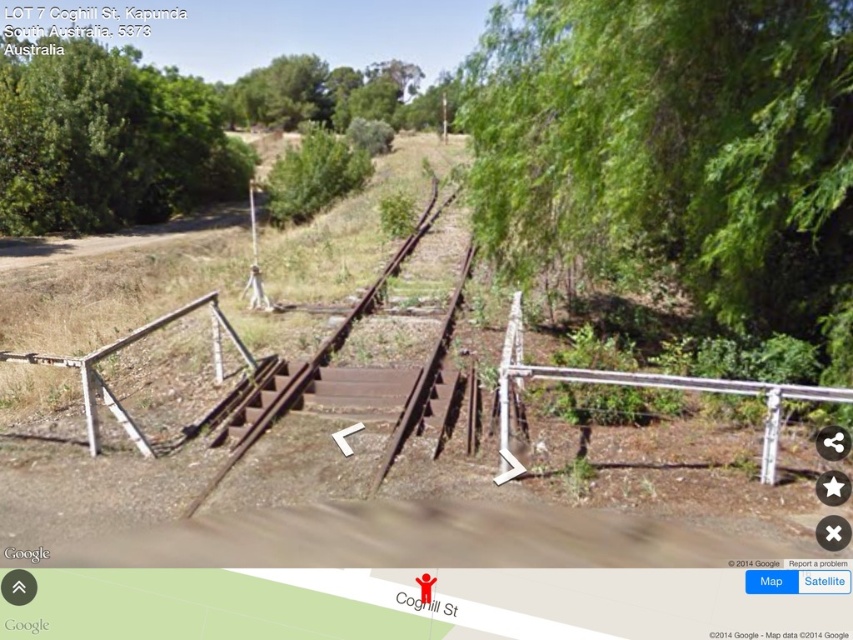
You are standing at the point marked by the coordinates point (106, 140) in the image of Kapunda, South Australia. What object is located at this point?

The point (106, 140) marks a green leafy tree at upper left.

You are a hiker planning to take a photo of the green leafy tree at center and the rusty metal rail at lower left. Based on their positions, which object should you frame first in your camera viewfinder to capture both in the same shot?

The green leafy tree at center is positioned on the left side of the rusty metal rail at lower left, so you should frame the green leafy tree at center first to ensure both objects are included in the shot.

You are standing on the dirt road looking towards the green leafy tree at upper left and the green leafy tree at center. Which tree is closer to you?

The green leafy tree at upper left is closer to the viewer than the green leafy tree at center.